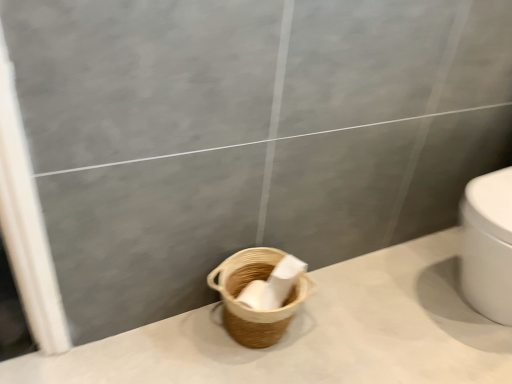
What do you see at coordinates (250, 308) in the screenshot? The height and width of the screenshot is (384, 512). I see `bamboo woven basket at center` at bounding box center [250, 308].

I want to click on bamboo woven basket at center, so pyautogui.click(x=250, y=308).

This screenshot has height=384, width=512. I want to click on bamboo woven basket at center, so click(250, 308).